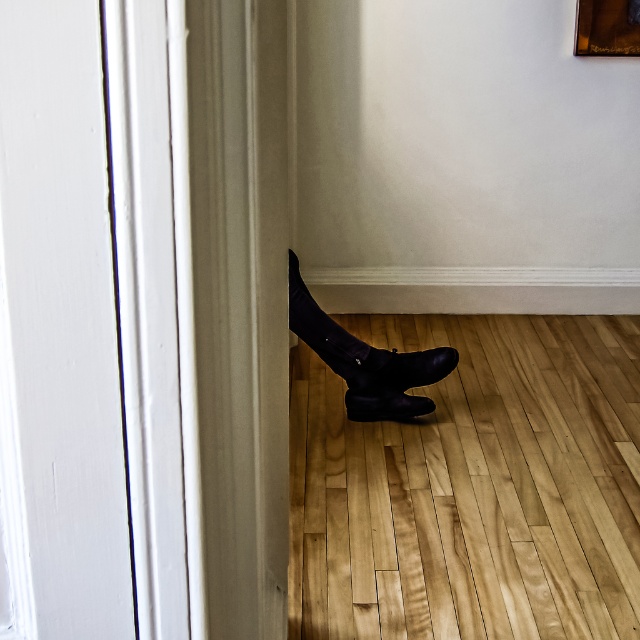
Question: Among these points, which one is farthest from the camera?

Choices:
 (A) (419, 365)
 (B) (440, 352)
 (C) (611, 4)
 (D) (358, 388)

Answer: (C)

Question: Among these objects, which one is farthest from the camera?

Choices:
 (A) wooden picture frame at upper right
 (B) black leather shoe at lower center

Answer: (A)

Question: From the image, what is the correct spatial relationship of black leather shoe at lower center in relation to wooden picture frame at upper right?

Choices:
 (A) below
 (B) above

Answer: (A)

Question: Which point is farther to the camera?

Choices:
 (A) black leather shoe at lower center
 (B) black suede boot at lower right

Answer: (A)

Question: Does black leather shoe at lower center come in front of black suede boot at lower center?

Choices:
 (A) no
 (B) yes

Answer: (B)

Question: Is wooden picture frame at upper right below black suede boot at lower center?

Choices:
 (A) yes
 (B) no

Answer: (B)